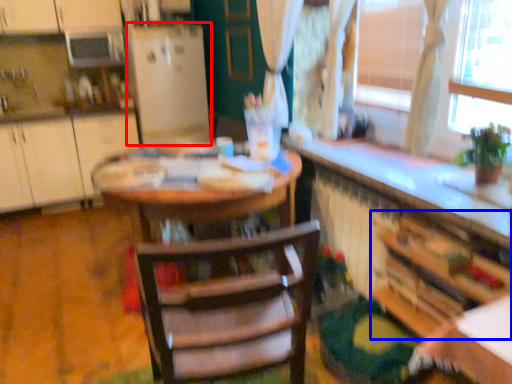
Question: Which object is closer to the camera taking this photo, fridge (highlighted by a red box) or cabinetry (highlighted by a blue box)?

Choices:
 (A) fridge
 (B) cabinetry

Answer: (B)